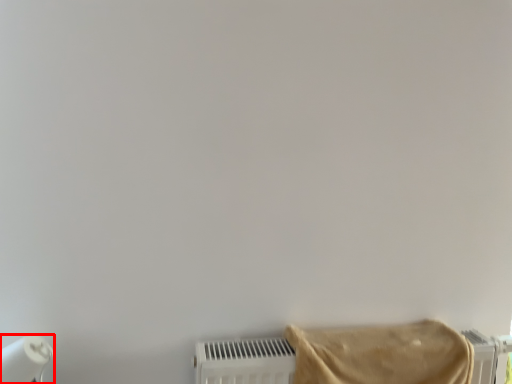
Question: In this image, where is paper towel (annotated by the red box) located relative to towel?

Choices:
 (A) right
 (B) left

Answer: (B)